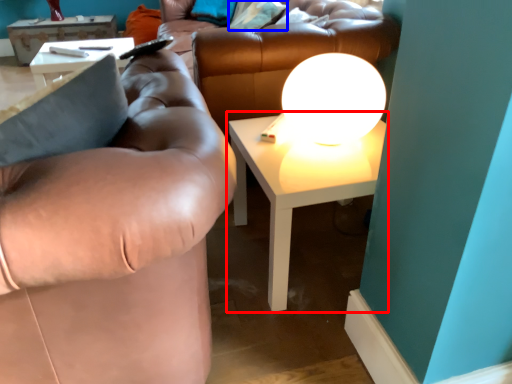
Question: Which of the following is the farthest to the observer, table (highlighted by a red box) or pillow (highlighted by a blue box)?

Choices:
 (A) table
 (B) pillow

Answer: (B)